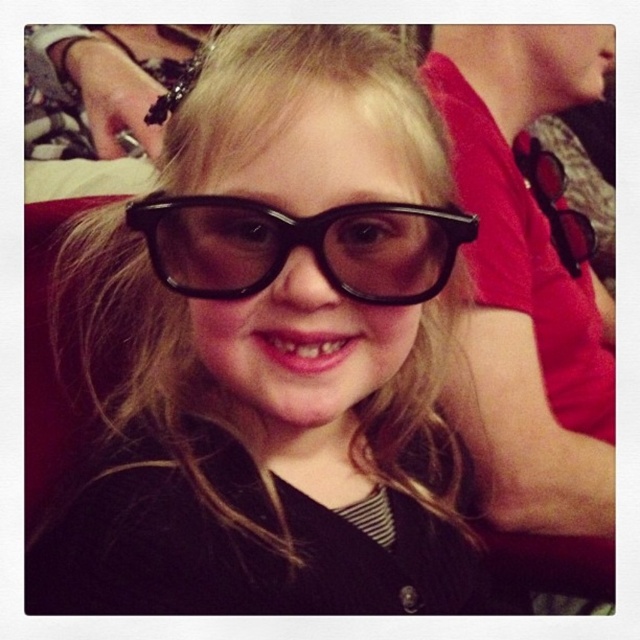
Question: Does black plastic glasses at center appear on the right side of black glossy glasses at center?

Choices:
 (A) no
 (B) yes

Answer: (A)

Question: Can you confirm if black plastic glasses at center is smaller than black glossy glasses at center?

Choices:
 (A) no
 (B) yes

Answer: (A)

Question: Among these points, which one is farthest from the camera?

Choices:
 (A) (433, 236)
 (B) (260, 58)

Answer: (A)

Question: Can you confirm if black plastic glasses at center is smaller than black glossy glasses at center?

Choices:
 (A) no
 (B) yes

Answer: (A)